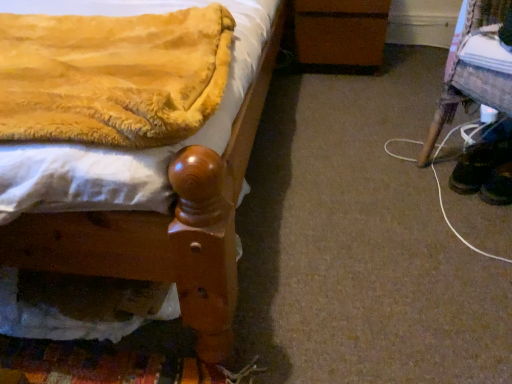
Identify the location of free area behind black leather shoes at lower right, which ranks as the first footwear in left-to-right order. (437, 153).